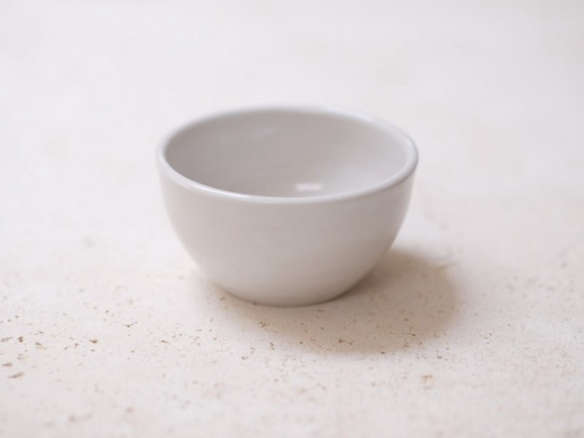
Identify the location of table surface. (475, 340).